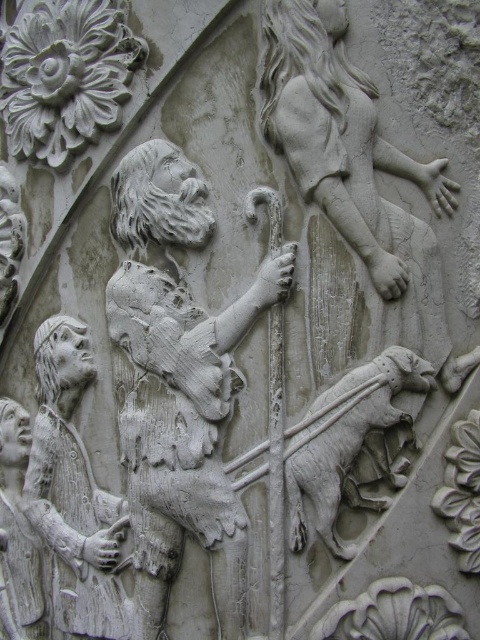
Question: Considering the relative positions of white stone shepherd at lower left and white stone lion at center in the image provided, where is white stone shepherd at lower left located with respect to white stone lion at center?

Choices:
 (A) right
 (B) left

Answer: (B)

Question: Can you confirm if white stone shepherd at center is smaller than white stone lion at center?

Choices:
 (A) no
 (B) yes

Answer: (A)

Question: Which object is positioned farthest from the white stone lion at center?

Choices:
 (A) white stone shepherd at lower left
 (B) white stone shepherd at center

Answer: (A)

Question: Does white stone shepherd at lower left appear on the right side of white stone lion at center?

Choices:
 (A) no
 (B) yes

Answer: (A)

Question: Which of these objects is positioned closest to the white stone lion at center?

Choices:
 (A) white stone shepherd at lower left
 (B) white stone shepherd at center

Answer: (B)

Question: Which of the following is the closest to the observer?

Choices:
 (A) (310, 472)
 (B) (124, 157)

Answer: (A)